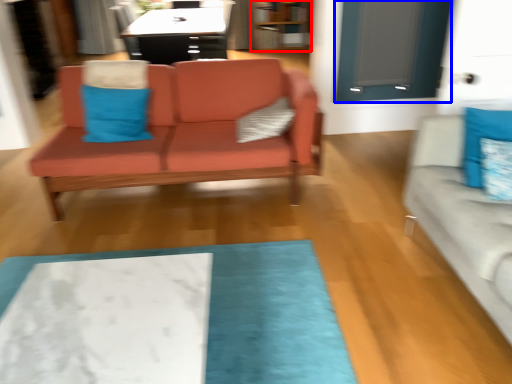
Question: Which of the following is the closest to the observer, bookshelf (highlighted by a red box) or glass door (highlighted by a blue box)?

Choices:
 (A) bookshelf
 (B) glass door

Answer: (B)